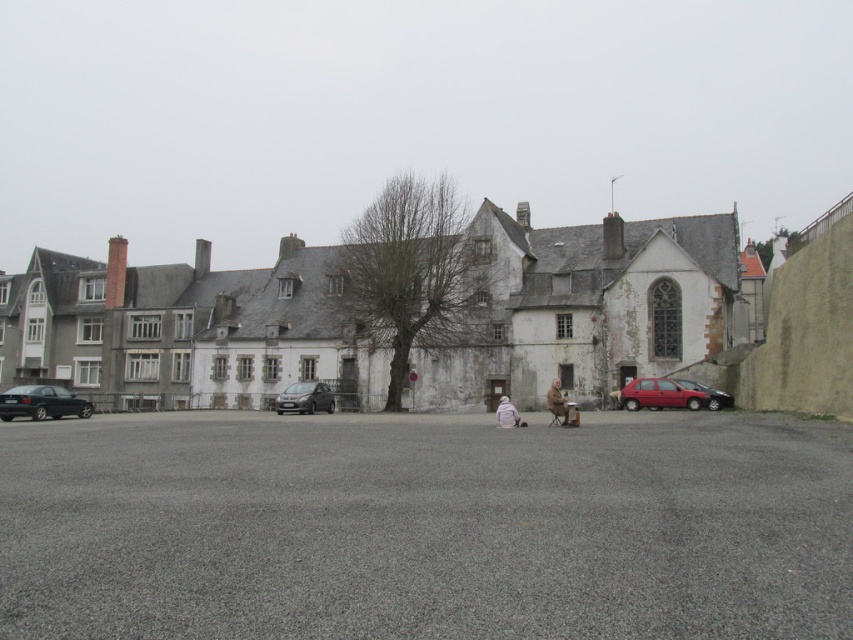
Question: Is satin black car at center closer to the viewer compared to white woolen sweater at center?

Choices:
 (A) no
 (B) yes

Answer: (A)

Question: Can you confirm if shiny black sedan at left is positioned to the right of satin black car at center?

Choices:
 (A) no
 (B) yes

Answer: (A)

Question: Estimate the real-world distances between objects in this image. Which object is closer to the satin black car at center?

Choices:
 (A) matte red hatchback at right
 (B) shiny black sedan at right

Answer: (A)

Question: Which is nearer to the white woolen coat at center?

Choices:
 (A) satin black car at center
 (B) shiny black sedan at left
 (C) white woolen sweater at center

Answer: (C)

Question: Does shiny black sedan at left lie behind white woolen sweater at center?

Choices:
 (A) no
 (B) yes

Answer: (B)

Question: Which object is the closest to the white woolen coat at center?

Choices:
 (A) matte red hatchback at right
 (B) shiny black sedan at left
 (C) satin black car at center
 (D) white woolen sweater at center

Answer: (D)